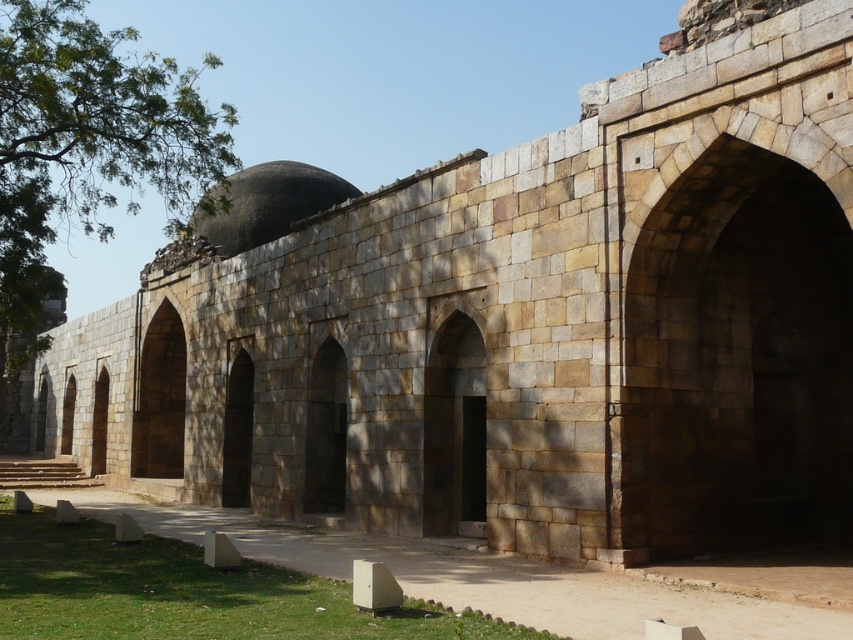
Question: Among these points, which one is farthest from the camera?

Choices:
 (A) (761, 413)
 (B) (207, 204)

Answer: (B)

Question: In this image, where is brown stone arch at right located relative to dark gray stone dome at center?

Choices:
 (A) below
 (B) above

Answer: (A)

Question: Does brown stone arch at right lie in front of dark gray stone dome at center?

Choices:
 (A) no
 (B) yes

Answer: (B)

Question: Which of the following is the farthest from the observer?

Choices:
 (A) (833, 490)
 (B) (257, 236)

Answer: (B)

Question: Does brown stone arch at right have a smaller size compared to dark gray stone dome at center?

Choices:
 (A) no
 (B) yes

Answer: (A)

Question: Which point is closer to the camera taking this photo?

Choices:
 (A) (724, 504)
 (B) (265, 198)

Answer: (A)